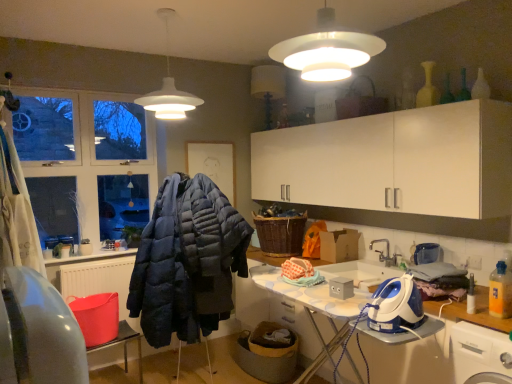
Question: Should I look upward or downward to see woven brown basket at center?

Choices:
 (A) up
 (B) down

Answer: (B)

Question: Can you confirm if silver metallic faucet at sink right is taller than dark blue quilted jacket at center?

Choices:
 (A) no
 (B) yes

Answer: (A)

Question: From the image's perspective, is silver metallic faucet at sink right located beneath dark blue quilted jacket at center?

Choices:
 (A) yes
 (B) no

Answer: (B)

Question: From a real-world perspective, is silver metallic faucet at sink right below dark blue quilted jacket at center?

Choices:
 (A) yes
 (B) no

Answer: (B)

Question: Does silver metallic faucet at sink right have a greater width compared to dark blue quilted jacket at center?

Choices:
 (A) no
 (B) yes

Answer: (A)

Question: Is silver metallic faucet at sink right touching dark blue quilted jacket at center?

Choices:
 (A) no
 (B) yes

Answer: (A)

Question: Does silver metallic faucet at sink right contain dark blue quilted jacket at center?

Choices:
 (A) yes
 (B) no

Answer: (B)

Question: Does woven brown basket at center turn towards blue plastic iron at lower right?

Choices:
 (A) yes
 (B) no

Answer: (B)

Question: Does woven brown basket at center appear on the right side of blue plastic iron at lower right?

Choices:
 (A) yes
 (B) no

Answer: (B)

Question: Is woven brown basket at center in contact with blue plastic iron at lower right?

Choices:
 (A) no
 (B) yes

Answer: (A)

Question: From a real-world perspective, is woven brown basket at center under blue plastic iron at lower right?

Choices:
 (A) no
 (B) yes

Answer: (A)

Question: Is woven brown basket at center located outside blue plastic iron at lower right?

Choices:
 (A) no
 (B) yes

Answer: (B)

Question: Considering the relative sizes of woven brown basket at center and blue plastic iron at lower right in the image provided, is woven brown basket at center shorter than blue plastic iron at lower right?

Choices:
 (A) yes
 (B) no

Answer: (B)

Question: Is blue plastic iron at lower right at the left side of dark blue quilted jacket at center?

Choices:
 (A) yes
 (B) no

Answer: (B)